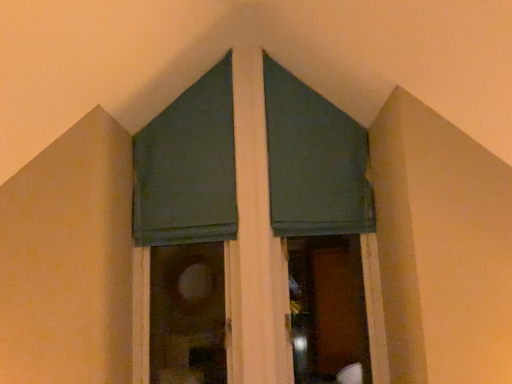
Question: Does green fabric at center appear on the left side of green fabric window screen at upper center?

Choices:
 (A) no
 (B) yes

Answer: (A)

Question: From a real-world perspective, is green fabric at center located beneath green fabric window screen at upper center?

Choices:
 (A) no
 (B) yes

Answer: (B)

Question: Does green fabric at center lie in front of green fabric window screen at upper center?

Choices:
 (A) yes
 (B) no

Answer: (A)

Question: Are green fabric at center and green fabric window screen at upper center beside each other?

Choices:
 (A) yes
 (B) no

Answer: (A)

Question: Considering the relative sizes of green fabric at center and green fabric window screen at upper center in the image provided, is green fabric at center wider than green fabric window screen at upper center?

Choices:
 (A) no
 (B) yes

Answer: (B)

Question: From the image's perspective, is green fabric at center on green fabric window screen at upper center?

Choices:
 (A) yes
 (B) no

Answer: (B)

Question: Is green fabric at center located within green fabric window screen at upper center?

Choices:
 (A) no
 (B) yes

Answer: (A)

Question: Would you say green fabric window screen at upper center is a long distance from green fabric at center?

Choices:
 (A) yes
 (B) no

Answer: (B)

Question: Considering the relative sizes of green fabric window screen at upper center and green fabric at center in the image provided, is green fabric window screen at upper center bigger than green fabric at center?

Choices:
 (A) no
 (B) yes

Answer: (A)

Question: Would you say green fabric window screen at upper center is outside green fabric at center?

Choices:
 (A) yes
 (B) no

Answer: (B)

Question: Does green fabric window screen at upper center have a greater width compared to green fabric at center?

Choices:
 (A) no
 (B) yes

Answer: (A)

Question: Is green fabric window screen at upper center positioned before green fabric at center?

Choices:
 (A) yes
 (B) no

Answer: (B)

Question: In terms of width, does green fabric at center look wider or thinner when compared to green fabric window screen at upper center?

Choices:
 (A) thin
 (B) wide

Answer: (B)